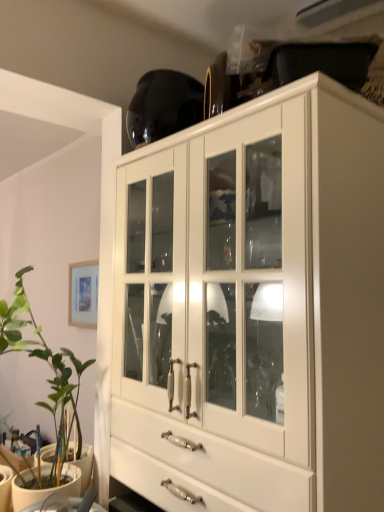
Question: From a real-world perspective, is green leafy plant at left physically below white glossy cabinet at upper center?

Choices:
 (A) no
 (B) yes

Answer: (B)

Question: Does green leafy plant at left lie behind white glossy cabinet at upper center?

Choices:
 (A) no
 (B) yes

Answer: (B)

Question: Can you confirm if green leafy plant at left is taller than white glossy cabinet at upper center?

Choices:
 (A) no
 (B) yes

Answer: (A)

Question: Is green leafy plant at left with white glossy cabinet at upper center?

Choices:
 (A) yes
 (B) no

Answer: (B)

Question: From the image's perspective, is green leafy plant at left beneath white glossy cabinet at upper center?

Choices:
 (A) yes
 (B) no

Answer: (A)

Question: Is green leafy plant at left closer to camera compared to white glossy cabinet at upper center?

Choices:
 (A) yes
 (B) no

Answer: (B)

Question: From the image's perspective, is white glossy cabinet at upper center below green leafy plant at left?

Choices:
 (A) yes
 (B) no

Answer: (B)

Question: Is white glossy cabinet at upper center facing away from green leafy plant at left?

Choices:
 (A) yes
 (B) no

Answer: (B)

Question: From the image's perspective, does white glossy cabinet at upper center appear higher than green leafy plant at left?

Choices:
 (A) no
 (B) yes

Answer: (B)

Question: Considering the relative positions of white glossy cabinet at upper center and green leafy plant at left in the image provided, is white glossy cabinet at upper center behind green leafy plant at left?

Choices:
 (A) no
 (B) yes

Answer: (A)

Question: Can you confirm if white glossy cabinet at upper center is positioned to the right of green leafy plant at left?

Choices:
 (A) no
 (B) yes

Answer: (B)

Question: Would you say white glossy cabinet at upper center is a long distance from green leafy plant at left?

Choices:
 (A) no
 (B) yes

Answer: (A)

Question: From their relative heights in the image, would you say green leafy plant at left is taller or shorter than white glossy cabinet at upper center?

Choices:
 (A) tall
 (B) short

Answer: (B)